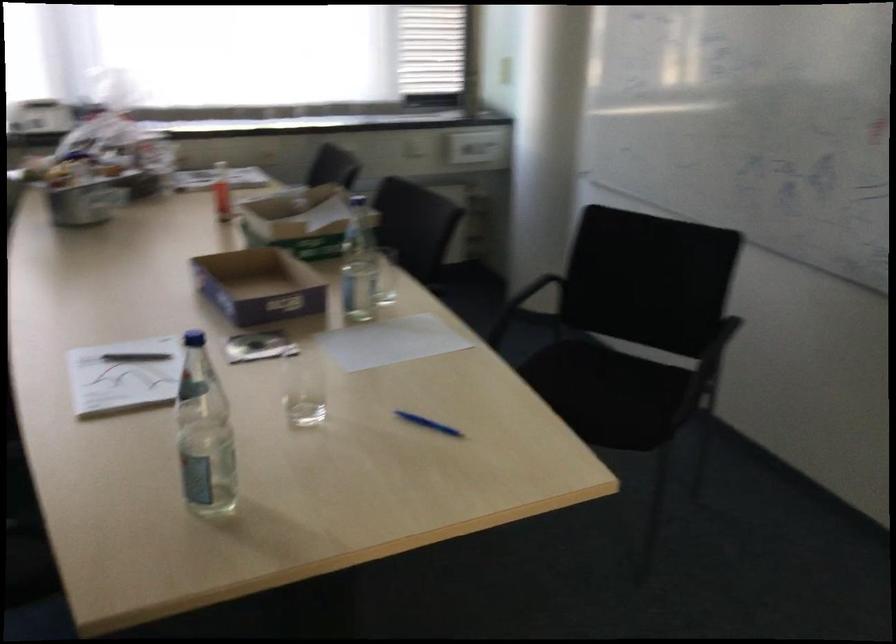
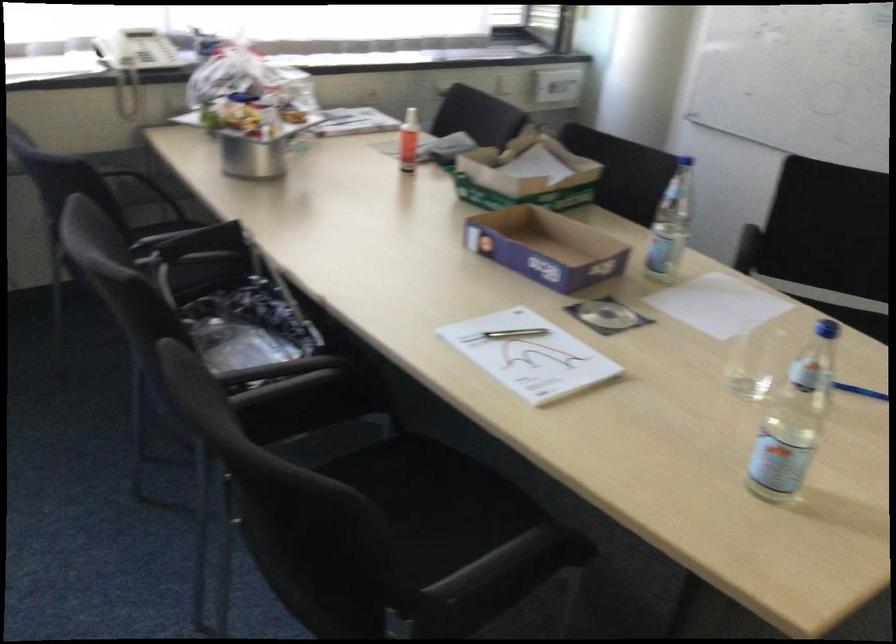
The point at (x=225, y=193) is marked in the first image. Where is the corresponding point in the second image?

(409, 140)